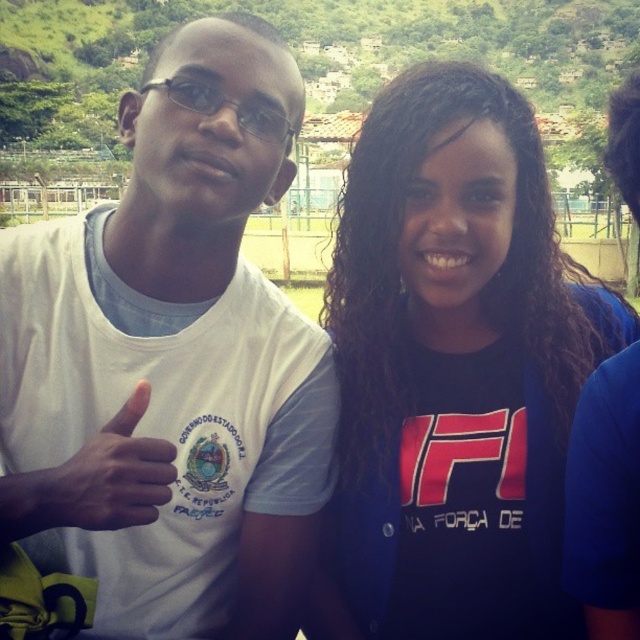
What is the location of the point with coordinates (452, 371) in the image?

The point with coordinates (452, 371) is located on the dark blue jersey at center.